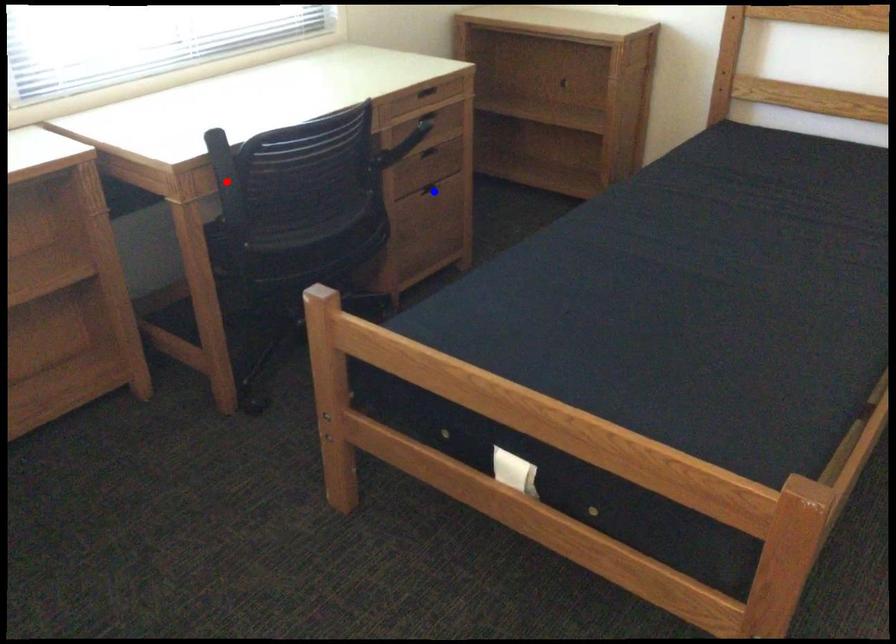
Question: In the image, two points are highlighted. Which point is nearer to the camera? Reply with the corresponding letter.

Choices:
 (A) blue point
 (B) red point

Answer: (B)